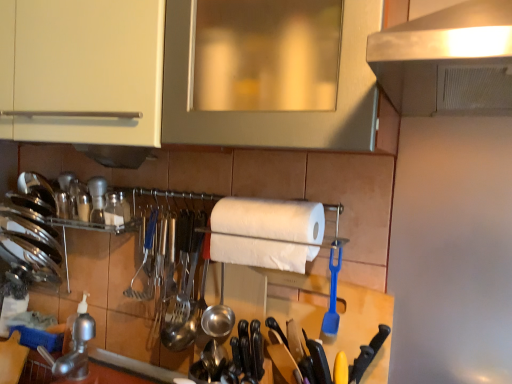
Question: In the image, is wooden spatula at center on the left side or the right side of white matte paper towel at center?

Choices:
 (A) left
 (B) right

Answer: (B)

Question: Based on their sizes in the image, would you say wooden spatula at center is bigger or smaller than white matte paper towel at center?

Choices:
 (A) small
 (B) big

Answer: (A)

Question: Estimate the real-world distances between objects in this image. Which object is farther from the blue plastic spatula at center, which appears as the first silverware when viewed from the right?

Choices:
 (A) shiny metallic utensils at center, which is the first silverware in back-to-front order
 (B) white glossy cabinet at upper center, which is counted as the second cabinetry, starting from the left
 (C) stainless steel faucet at lower left
 (D) white matte paper towel at center
 (E) white matte cabinet at upper left, arranged as the 1th cabinetry when viewed from the left

Answer: (C)

Question: Estimate the real-world distances between objects in this image. Which object is closer to the white glossy cabinet at upper center, placed as the 1th cabinetry when sorted from right to left?

Choices:
 (A) white matte paper towel at center
 (B) white matte cabinet at upper left, which is counted as the second cabinetry, starting from the right
 (C) blue plastic spatula at center, which appears as the first silverware when viewed from the right
 (D) wooden spatula at center
 (E) polished metal knife set at center, the 2th silverware when ordered from left to right

Answer: (B)